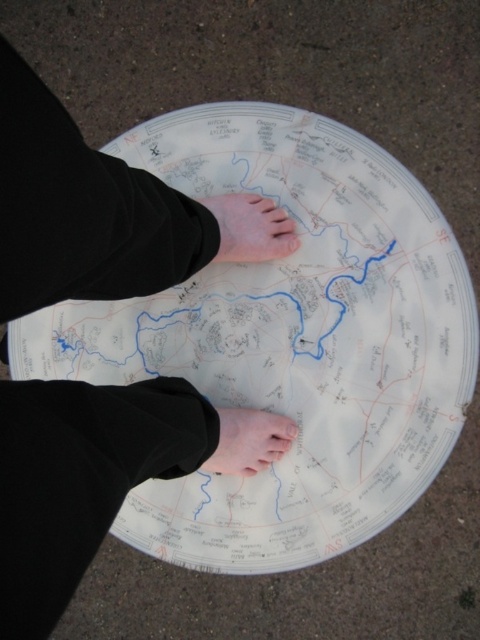
Which is above, white paper plate at center or pink flesh at lower center?

white paper plate at center

Can you confirm if white paper plate at center is smaller than pink flesh at lower center?

No.

Locate an element on the screen. white paper plate at center is located at coordinates (287, 340).

From the picture: Can you confirm if light skin barefoot at center is bigger than pink flesh at lower center?

Correct, light skin barefoot at center is larger in size than pink flesh at lower center.

This screenshot has height=640, width=480. Find the location of `light skin barefoot at center`. light skin barefoot at center is located at coordinates (251, 228).

Where is `light skin barefoot at center`? light skin barefoot at center is located at coordinates (251, 228).

Which is behind, point (424, 248) or point (288, 230)?

Point (288, 230)

Does point (327, 180) come closer to viewer compared to point (276, 253)?

Yes, point (327, 180) is in front of point (276, 253).

Image resolution: width=480 pixels, height=640 pixels. I want to click on white paper plate at center, so click(x=287, y=340).